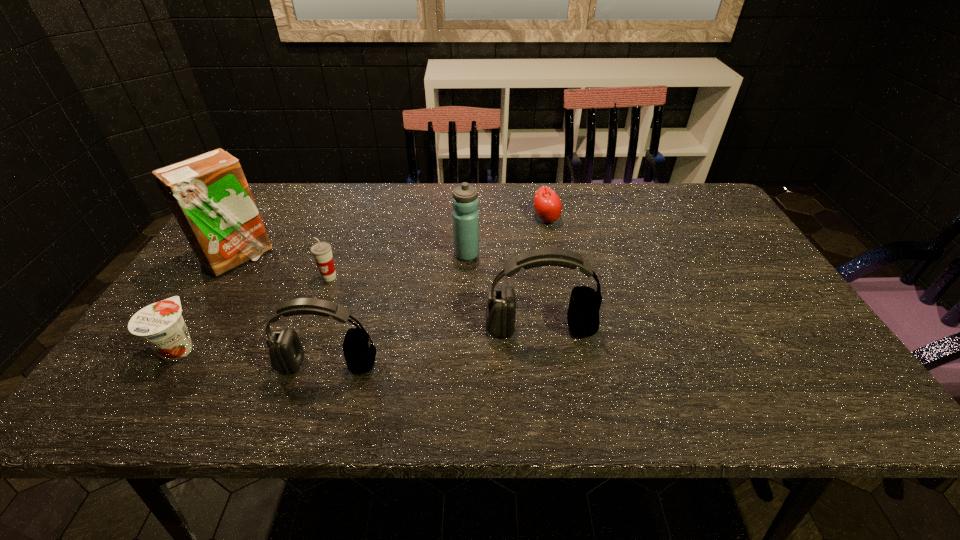
Find the location of `the shorter headset`. the shorter headset is located at coordinates (286, 353).

This screenshot has width=960, height=540. In order to click on the fourth shortest object in this screenshot , I will do click(286, 353).

Locate an element on the screen. the right headset is located at coordinates (583, 319).

The image size is (960, 540). I want to click on the taller headset, so click(x=583, y=319).

Where is `the tallest object`? This screenshot has height=540, width=960. the tallest object is located at coordinates (208, 194).

Locate an element on the screen. the farthest object is located at coordinates (547, 204).

This screenshot has height=540, width=960. Find the location of `cup`. cup is located at coordinates (321, 251).

Where is `the third object from right to left`? The width and height of the screenshot is (960, 540). the third object from right to left is located at coordinates [465, 202].

Find the location of a particular element. yogurt is located at coordinates (160, 325).

You are a GUI agent. You are given a task and a screenshot of the screen. Output one action in this format:
    pyautogui.click(x=<x>, y=<y>)
    Task: Click on the vacant space located on the headband of the taller headset
    
    Given the screenshot: What is the action you would take?
    pyautogui.click(x=545, y=362)